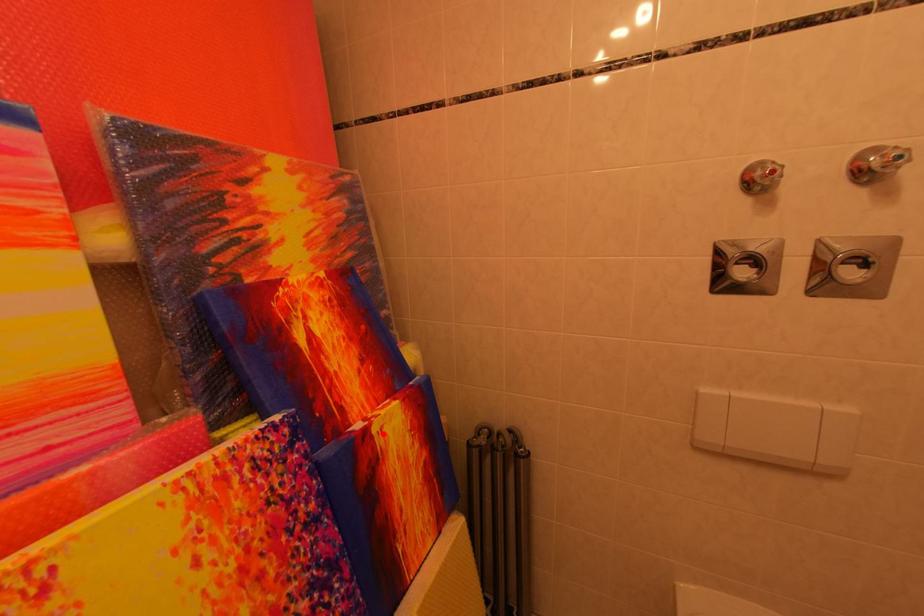
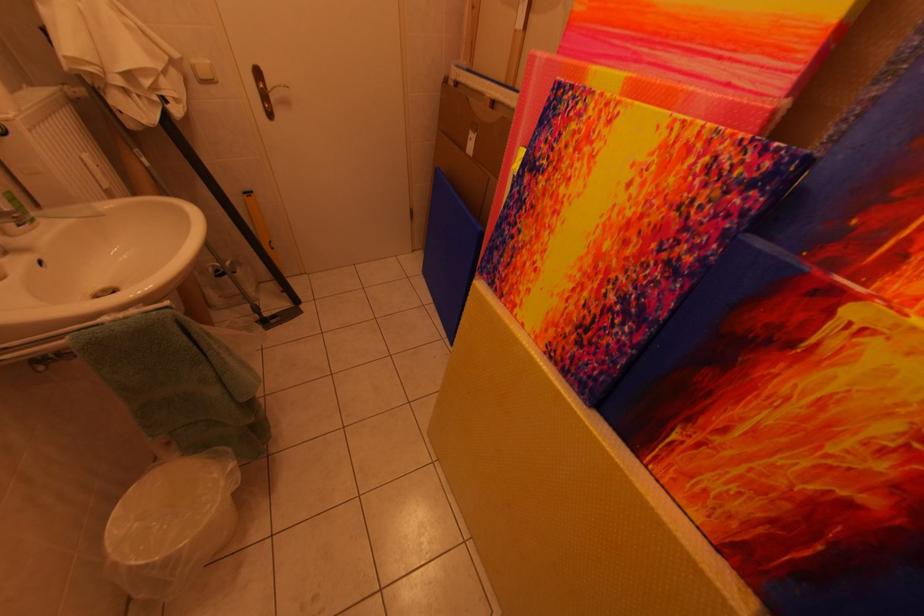
Locate, in the second image, the point that corresponds to the highlighted location in the first image.

(861, 317)